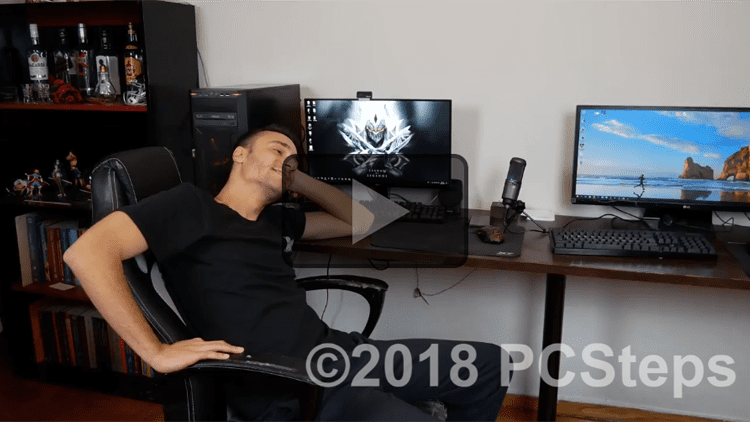
Locate an element on the screen. The width and height of the screenshot is (750, 422). bookcase is located at coordinates (158, 58).